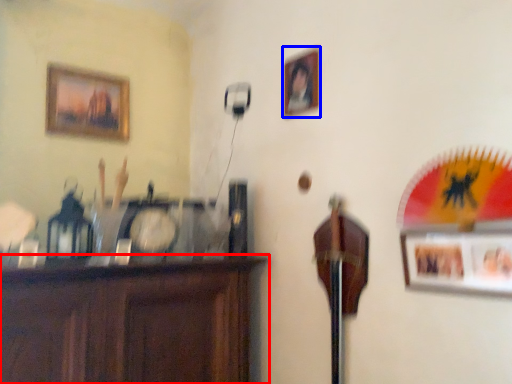
Question: Which point is closer to the camera, furniture (highlighted by a red box) or picture frame (highlighted by a blue box)?

Choices:
 (A) furniture
 (B) picture frame

Answer: (A)